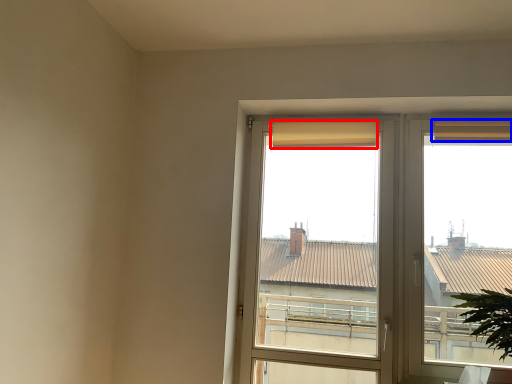
Question: Which object is closer to the camera taking this photo, curtain (highlighted by a red box) or curtain (highlighted by a blue box)?

Choices:
 (A) curtain
 (B) curtain

Answer: (B)